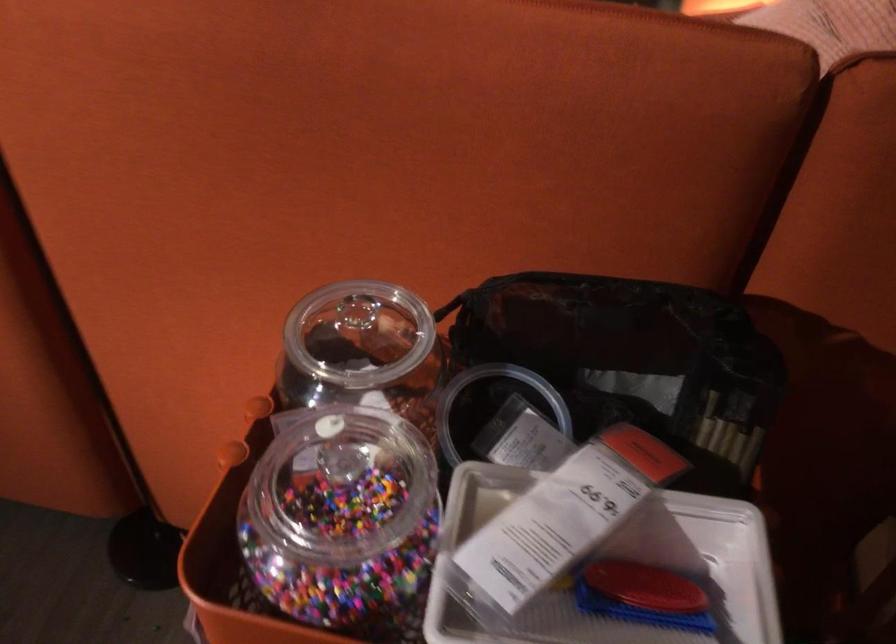
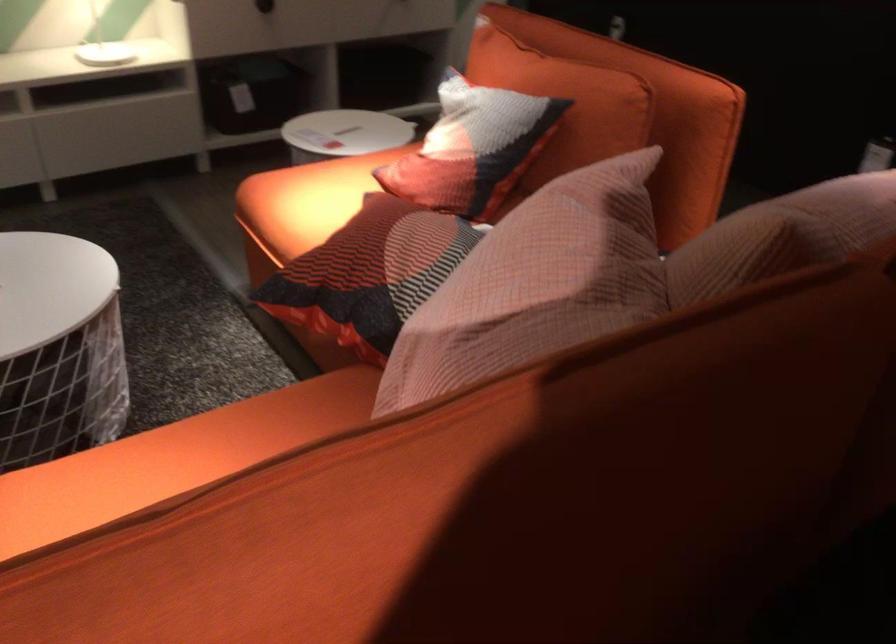
Question: How did the camera likely rotate?

Choices:
 (A) Left
 (B) Right
 (C) Up
 (D) Down

Answer: (B)